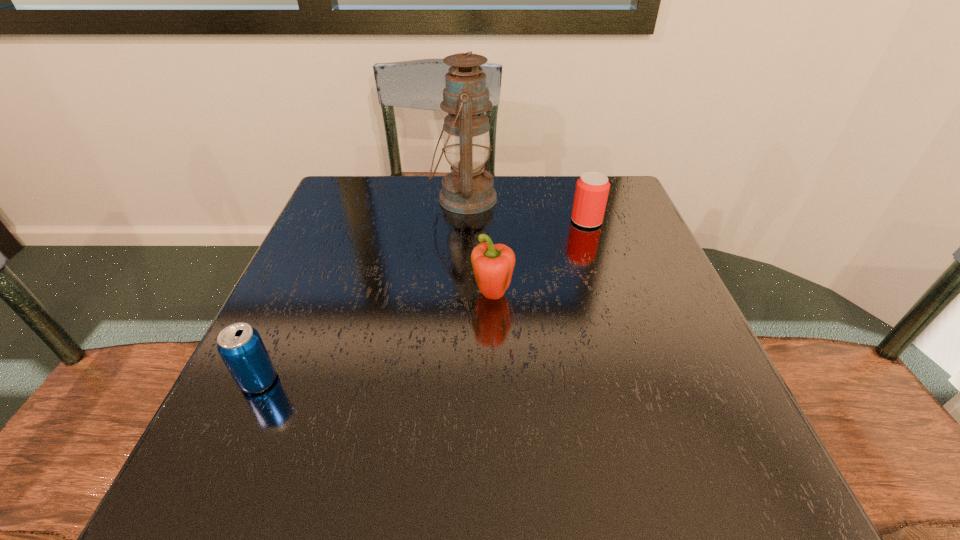
What are the coordinates of `vacant space at the near right corner of the desktop` in the screenshot? It's located at (659, 474).

Locate an element on the screen. The width and height of the screenshot is (960, 540). free space between the nearest object and the rightmost object is located at coordinates (422, 301).

The image size is (960, 540). What are the coordinates of `free point between the oil lamp and the beer can` in the screenshot? It's located at (526, 210).

Find the location of a particular element. Image resolution: width=960 pixels, height=540 pixels. vacant area that lies between the oil lamp and the pop soda is located at coordinates (362, 289).

This screenshot has width=960, height=540. Identify the location of vacant area that lies between the second tallest object and the pop soda. (375, 339).

At what (x,y) coordinates should I click in order to perform the action: click on vacant space that is in between the oil lamp and the pop soda. Please return your answer as a coordinate pair (x, y). Looking at the image, I should click on (362, 289).

Where is `free spot between the rightmost object and the third farthest object`? free spot between the rightmost object and the third farthest object is located at coordinates (540, 259).

This screenshot has width=960, height=540. I want to click on free spot between the nearest object and the second tallest object, so click(375, 339).

This screenshot has width=960, height=540. What are the coordinates of `vacant space in between the nearest object and the oil lamp` in the screenshot? It's located at (362, 289).

I want to click on vacant space in between the nearest object and the oil lamp, so click(362, 289).